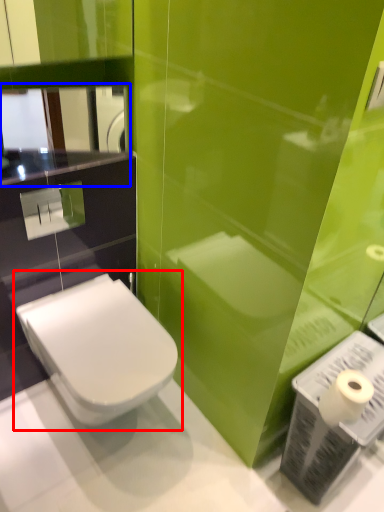
Question: Which object appears farthest to the camera in this image, toilet (highlighted by a red box) or mirror (highlighted by a blue box)?

Choices:
 (A) toilet
 (B) mirror

Answer: (B)